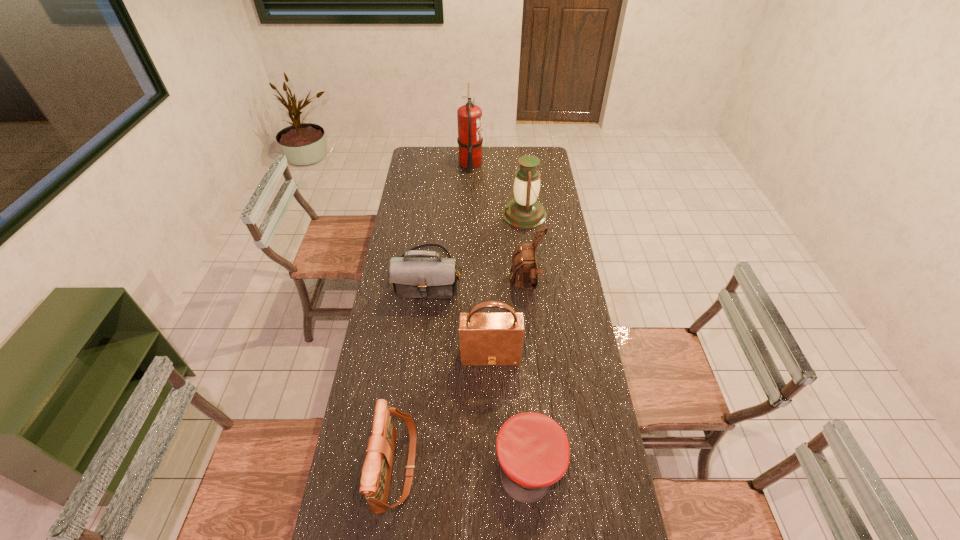
Locate an element on the screen. This screenshot has width=960, height=540. free spot between the shortest object and the third farthest shoulder bag is located at coordinates (511, 408).

Locate an element on the screen. This screenshot has width=960, height=540. vacant region between the nearest shoulder bag and the fifth farthest object is located at coordinates (444, 410).

What are the coordinates of `free space between the second farthest object and the shortest object` in the screenshot? It's located at (528, 339).

Identify which object is the fifth nearest to the fire extinguisher. Please provide its 2D coordinates. Your answer should be formatted as a tuple, i.e. [(x, y)], where the tuple contains the x and y coordinates of a point satisfying the conditions above.

[(376, 473)]

This screenshot has height=540, width=960. In order to click on object identified as the sixth closest to the third farthest shoulder bag in this screenshot , I will do `click(469, 117)`.

At what (x,y) coordinates should I click in order to perform the action: click on shoulder bag object that ranks as the third closest to the nearest shoulder bag. Please return your answer as a coordinate pair (x, y). Looking at the image, I should click on (524, 270).

Find the location of a particular element. This screenshot has height=540, width=960. shoulder bag that is the third closest to the farthest object is located at coordinates (486, 338).